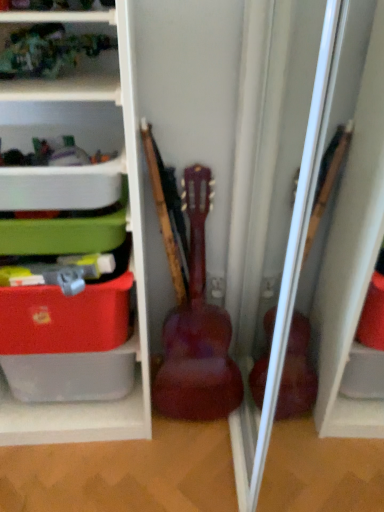
Question: Is white plastic container at upper left, the first shelf from the top, wider or thinner than glossy wood guitar at center?

Choices:
 (A) thin
 (B) wide

Answer: (B)

Question: Is white plastic container at upper left, the 2th shelf ordered from the bottom, bigger or smaller than glossy wood guitar at center?

Choices:
 (A) big
 (B) small

Answer: (B)

Question: Which object is the closest to the matte plastic storage box at left?

Choices:
 (A) white plastic container at upper left, the 2th shelf ordered from the bottom
 (B) matte plastic storage at left, marked as the 2th shelf in a top-to-bottom arrangement
 (C) glossy wood guitar at center

Answer: (B)

Question: Considering the real-world distances, which object is closest to the white plastic container at upper left, the first shelf from the top?

Choices:
 (A) matte plastic storage box at left
 (B) glossy wood guitar at center
 (C) matte plastic storage at left, the 1th shelf positioned from the bottom

Answer: (C)